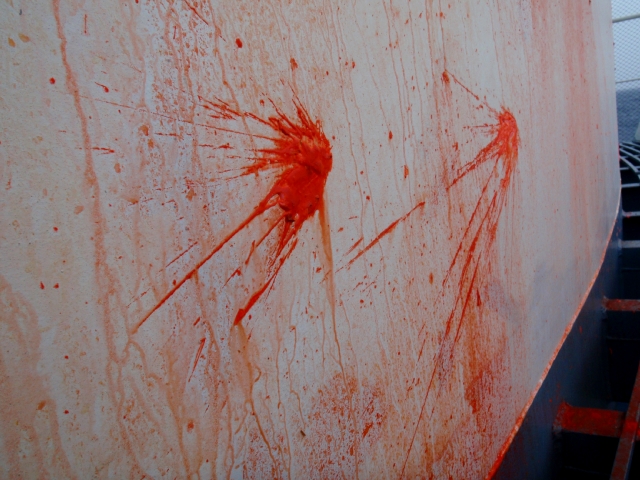
At what (x,y) coordinates should I click in order to perform the action: click on off white wall. Please return your answer as a coordinate pair (x, y). The image size is (640, 480). Looking at the image, I should click on 550,245.